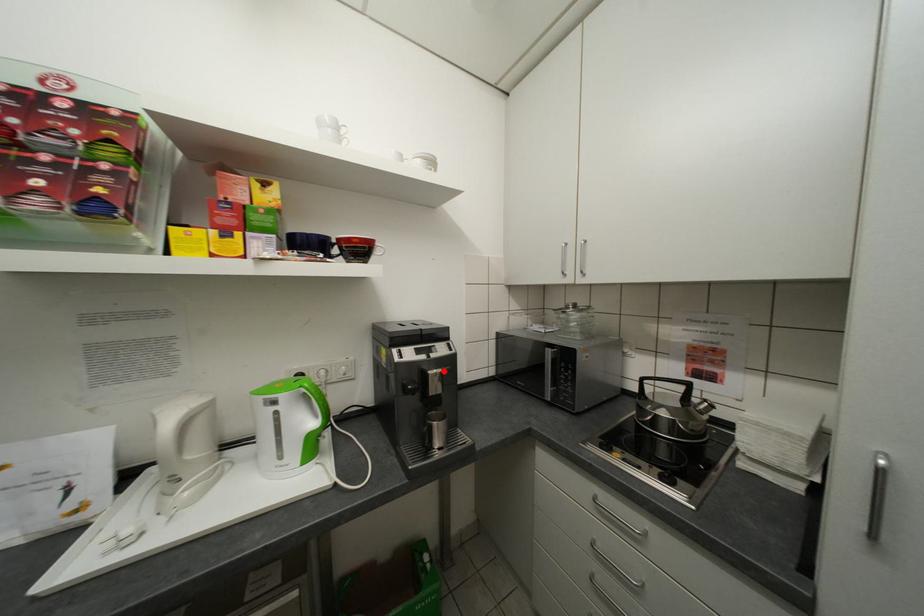
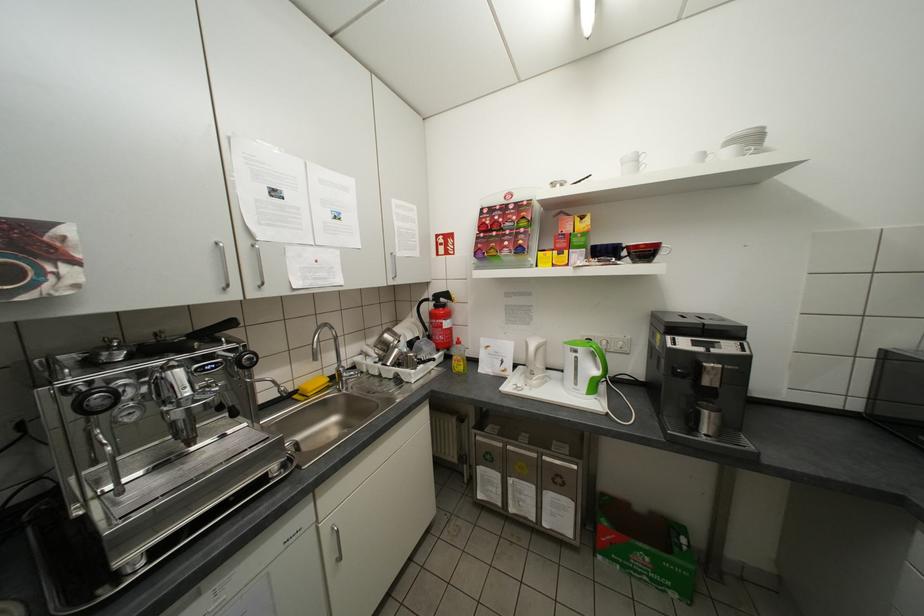
In the second image, find the point that corresponds to the highlighted location in the first image.

(721, 365)